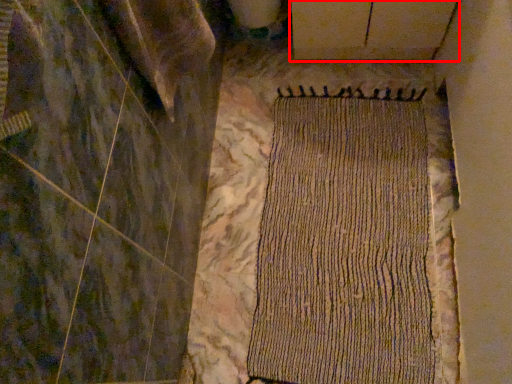
Question: In this image, where is plywood (annotated by the red box) located relative to mat?

Choices:
 (A) right
 (B) left

Answer: (A)